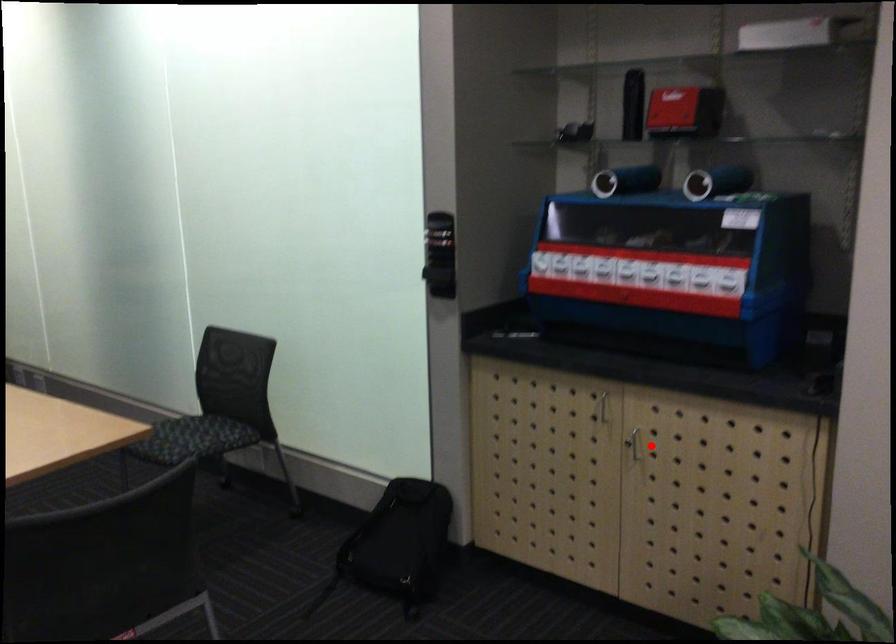
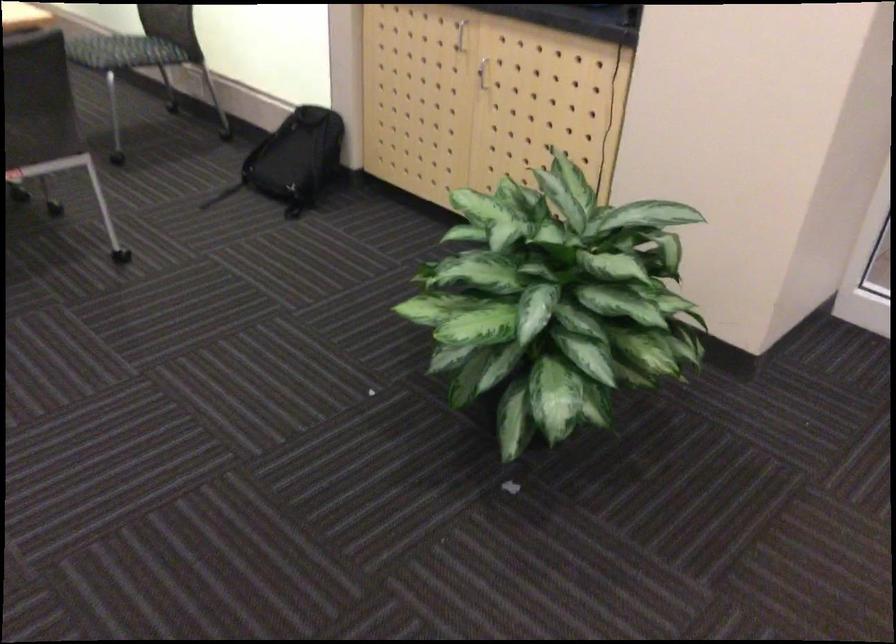
Question: I am providing you with two images of the same scene from different viewpoints. In image1, a red point is highlighted. Considering the same 3D point in image2, which of the following is correct?

Choices:
 (A) It is closer
 (B) It is farther

Answer: (B)